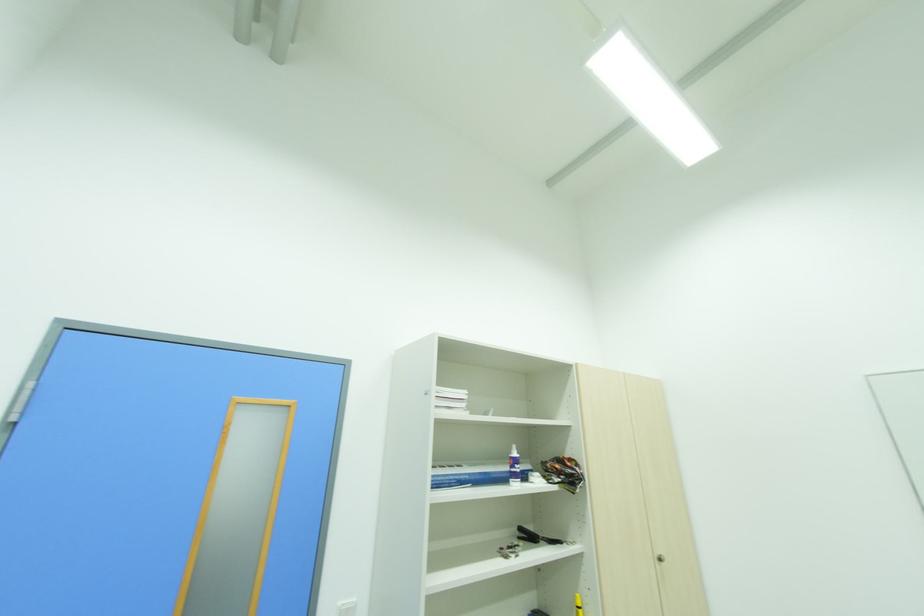
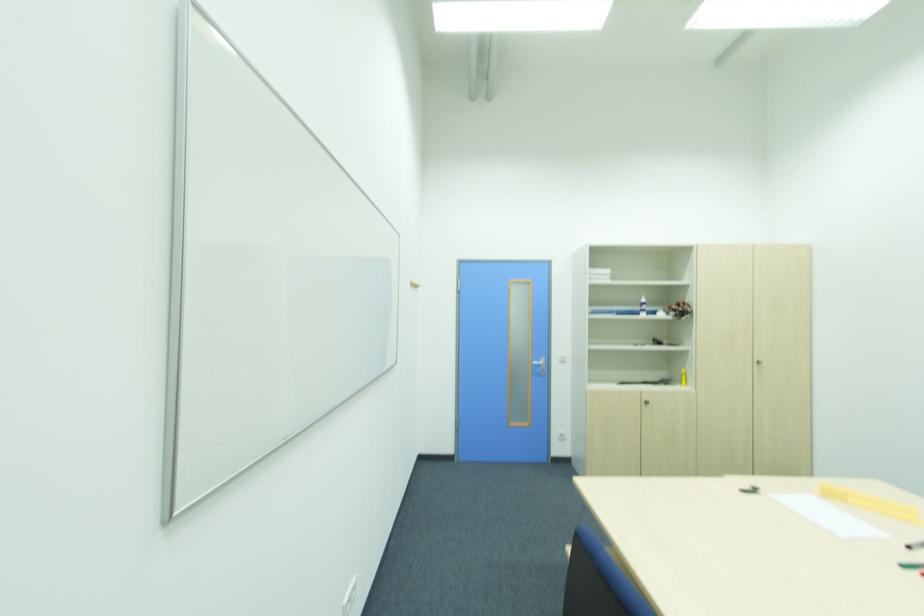
The point at (514,454) is marked in the first image. Where is the corresponding point in the second image?

(643, 301)